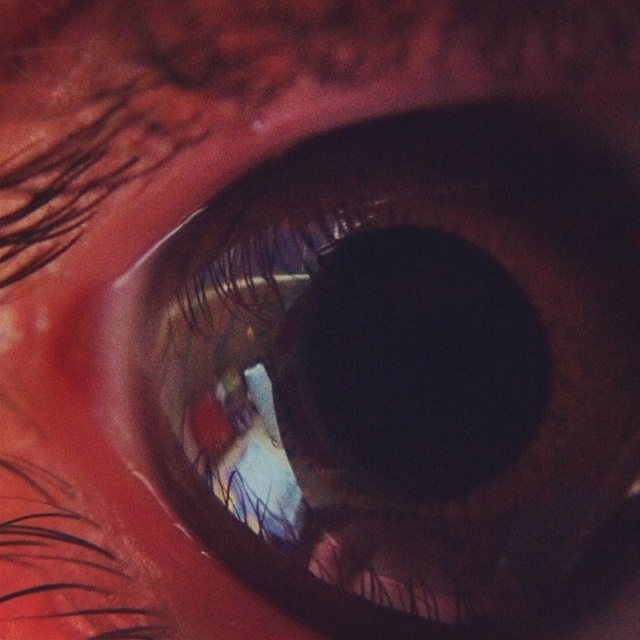
Is brown matte eye at center further to camera compared to black matte lens at center?

No, brown matte eye at center is closer to the viewer.

Does brown matte eye at center have a lesser height compared to black matte lens at center?

In fact, brown matte eye at center may be taller than black matte lens at center.

At what (x,y) coordinates should I click in order to perform the action: click on brown matte eye at center. Please return your answer as a coordinate pair (x, y). Image resolution: width=640 pixels, height=640 pixels. Looking at the image, I should click on (404, 371).